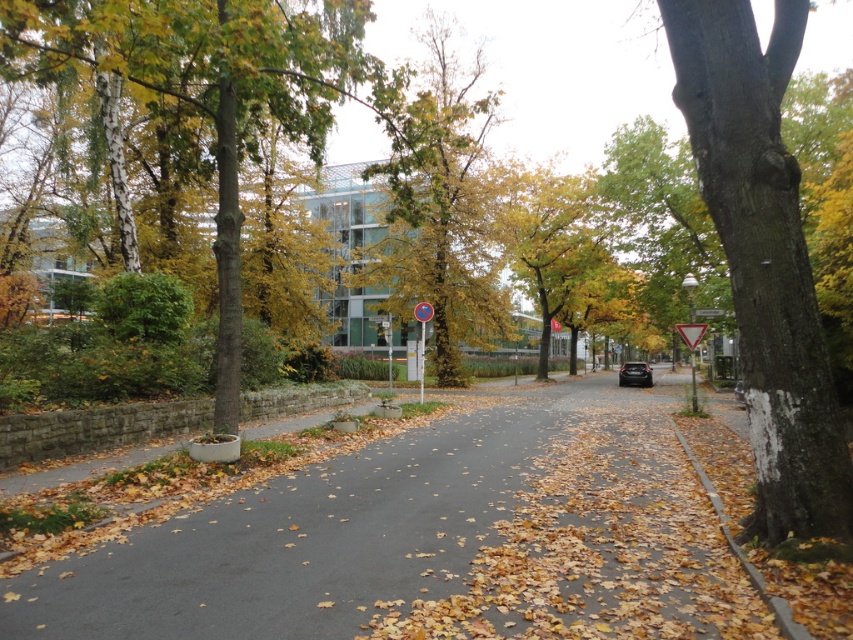
From the picture: Does smooth asphalt road at center have a smaller size compared to green smooth tree at left?

Correct, smooth asphalt road at center occupies less space than green smooth tree at left.

Who is shorter, smooth asphalt road at center or green smooth tree at left?

smooth asphalt road at center

Find the location of `smooth asphalt road at center`. smooth asphalt road at center is located at coordinates (431, 540).

Identify the location of smooth asphalt road at center. (431, 540).

Can you confirm if smooth asphalt road at center is thinner than smooth bark tree at right?

Incorrect, smooth asphalt road at center's width is not less than smooth bark tree at right's.

Does smooth asphalt road at center have a greater height compared to smooth bark tree at right?

No, smooth asphalt road at center is not taller than smooth bark tree at right.

Is point (352, 554) positioned after point (717, 193)?

Yes, it is.

The width and height of the screenshot is (853, 640). Find the location of `smooth asphalt road at center`. smooth asphalt road at center is located at coordinates (431, 540).

What do you see at coordinates (207, 90) in the screenshot? I see `green smooth tree at left` at bounding box center [207, 90].

Does green smooth tree at left appear on the left side of metallic rectangular sign at center?

Yes, green smooth tree at left is to the left of metallic rectangular sign at center.

Who is more forward, (271, 88) or (419, 387)?

Point (271, 88) is in front.

The height and width of the screenshot is (640, 853). Find the location of `green smooth tree at left`. green smooth tree at left is located at coordinates (207, 90).